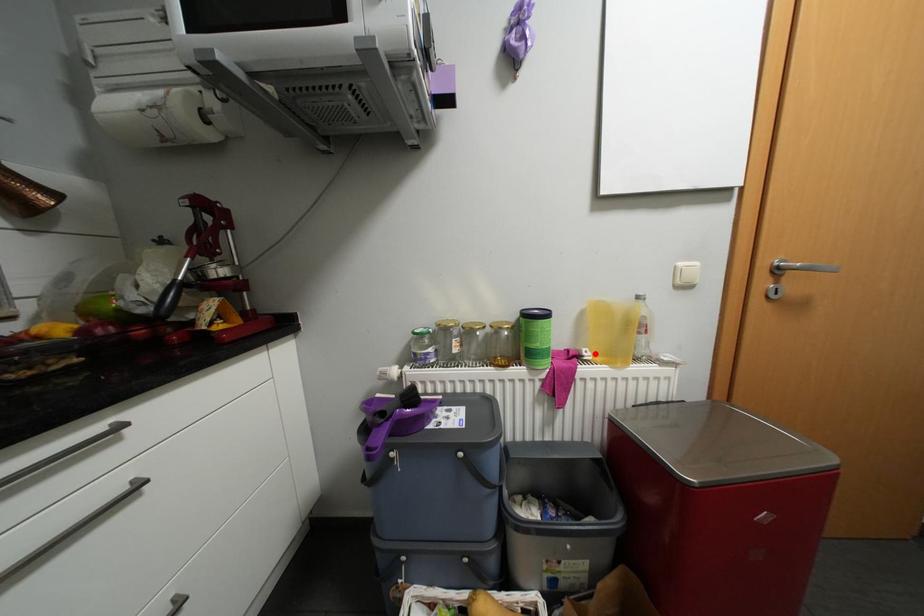
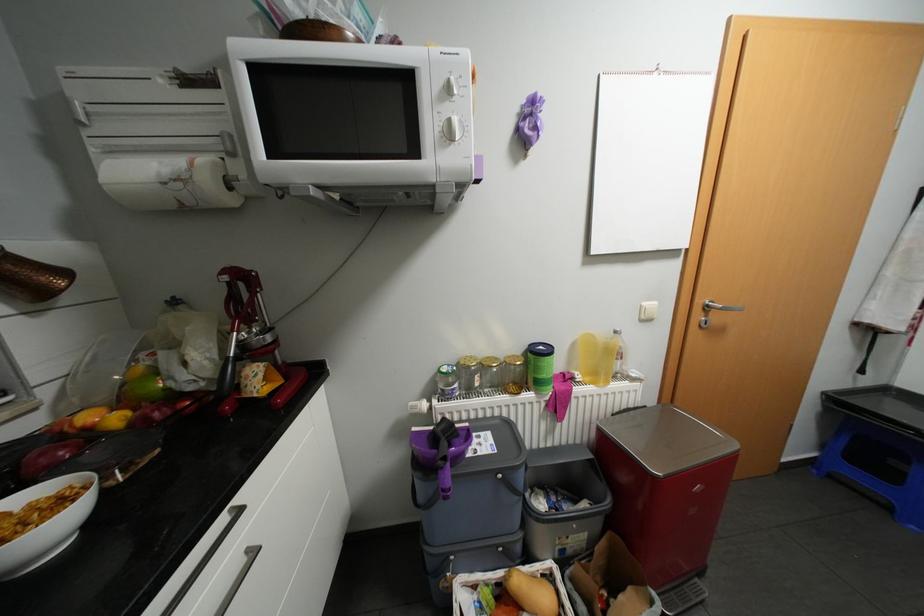
The point at the highlighted location is marked in the first image. Where is the corresponding point in the second image?

(587, 377)